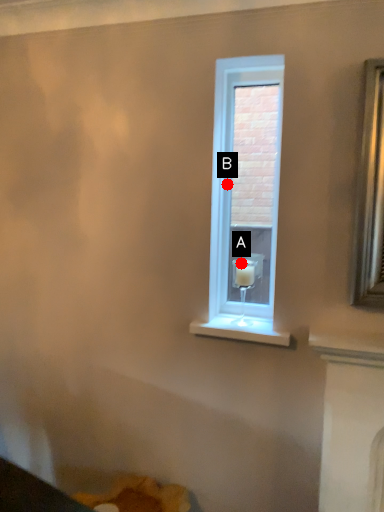
Question: Two points are circled on the image, labeled by A and B beside each circle. Which point is closer to the camera?

Choices:
 (A) A is closer
 (B) B is closer

Answer: (B)